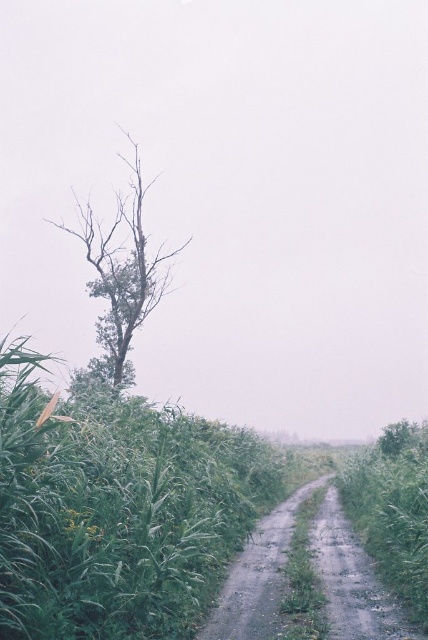
You are standing on the dirt path in the center of the scene. There are two points marked in the image, point 1 at coordinates (77, 209) and point 2 at (278, 536). If you want to walk towards the point that is closer to you, which point should you head towards?

You should head towards point 1 at coordinates (77, 209) because it is closer to you than point 2 at (278, 536).